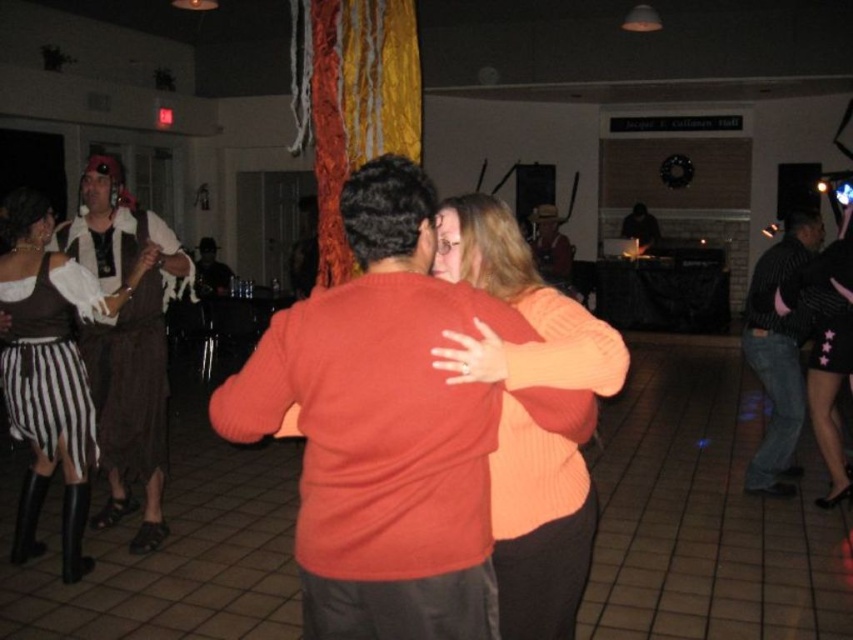
You are a photographer at the event and want to capture a photo of both the knitted peach sweater at center and the brown leather jacket at center in the same frame. Given that your camera has a focal length of 50mm and the minimum distance between subjects for clear focus is 5 meters, will you be able to include both in the shot?

The knitted peach sweater at center and brown leather jacket at center are 5.31 meters apart, which exceeds the minimum required distance of 5 meters for clear focus. Therefore, both can be captured clearly in the same frame.

You are at a party in the Jacque E. Collison Hall and see the knitted peach sweater at center and the striped fabric skirt at left. Which one is closer to you?

The knitted peach sweater at center is closer to you because it is in front of the striped fabric skirt at left.

You are at a party and want to take a photo of the knitted peach sweater at center and the striped fabric skirt at left. To frame them properly, which one should be placed to the right side in your camera view?

The knitted peach sweater at center is positioned on the right side of striped fabric skirt at left, so in your camera view, the knitted peach sweater at center should be placed to the right side.